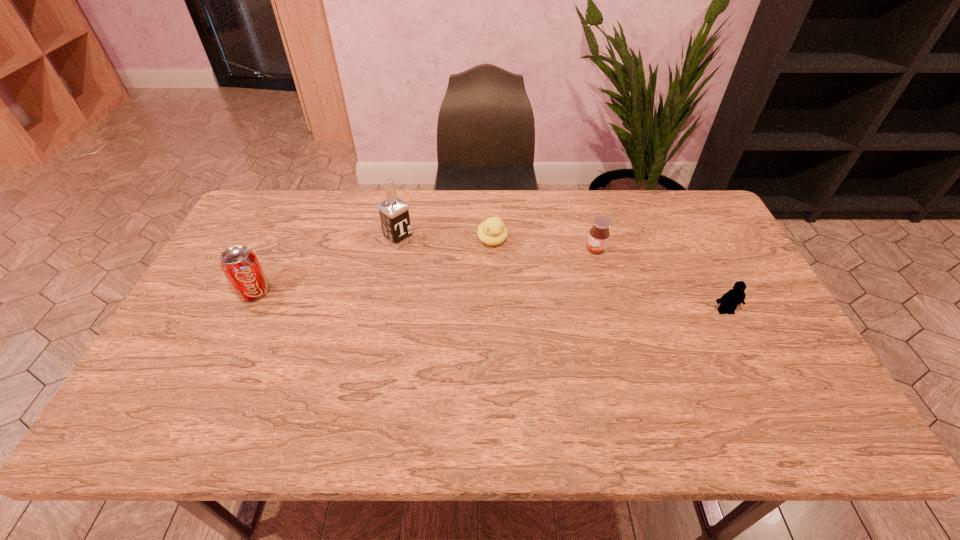
Image resolution: width=960 pixels, height=540 pixels. Identify the location of free space on the desktop that is between the second tallest object and the rightmost object and is positioned on the front label of the tallest object. (482, 301).

The image size is (960, 540). Identify the location of free space on the desktop that is between the soda can and the Lego and is positioned on the label side of the jam. (466, 300).

Identify the location of vacant space on the desktop that is between the second nearest object and the Lego and is positioned at the beak of the duckling. (514, 302).